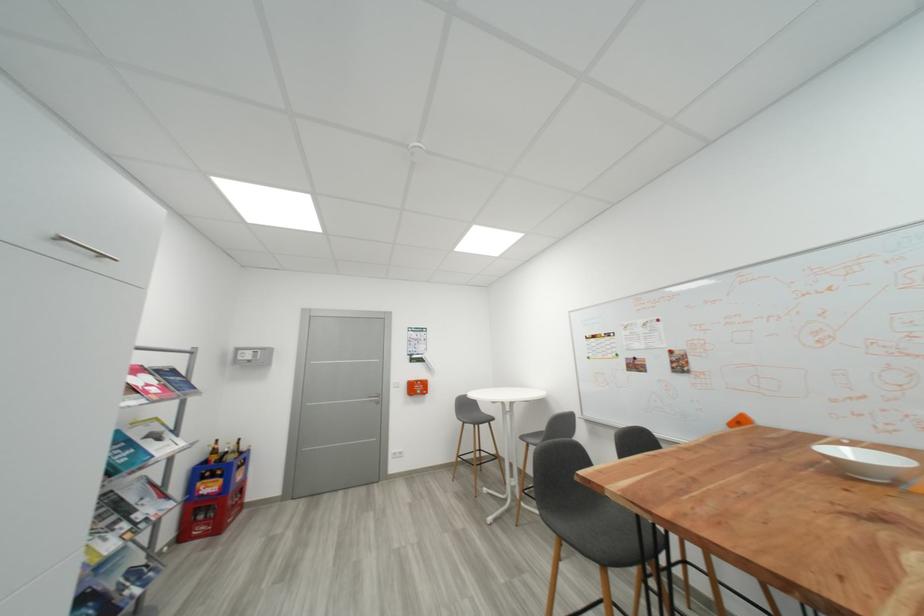
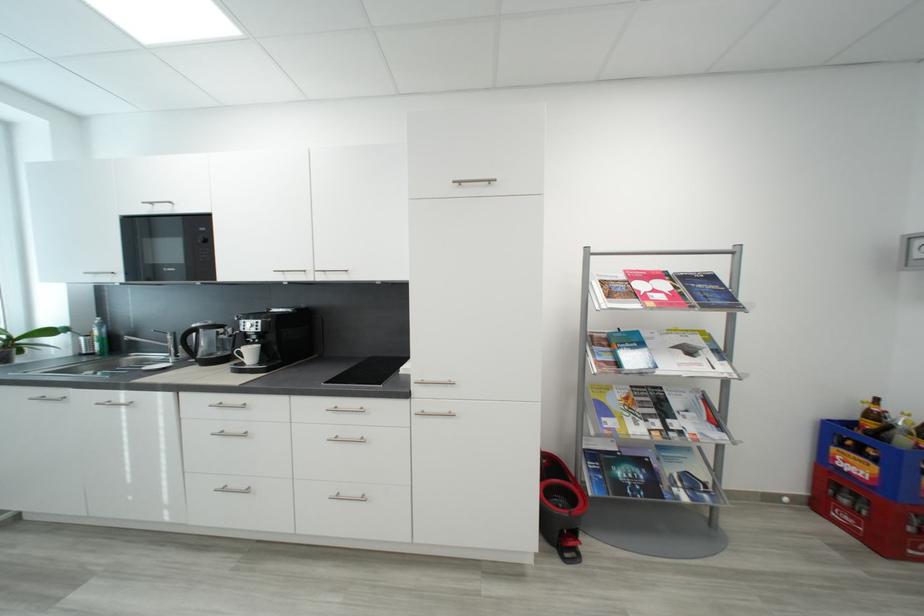
Where in the second image is the point corresponding to point 220,477 from the first image?

(867, 454)